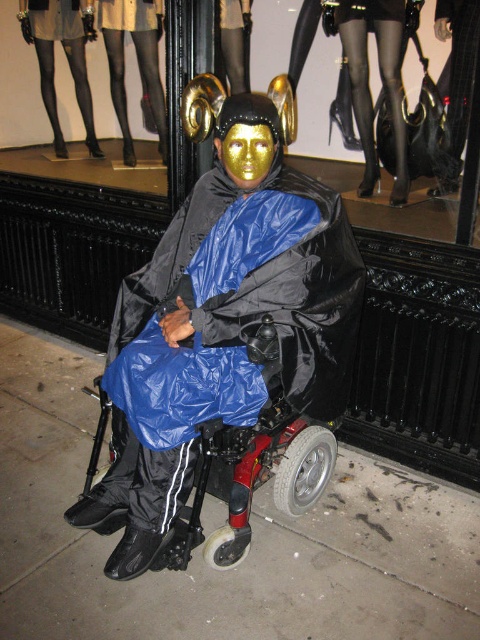
Question: Among these objects, which one is nearest to the camera?

Choices:
 (A) black tights at upper center
 (B) metallic gold mask at center
 (C) brushed metal belt at upper center
 (D) shiny gold mask at center

Answer: (D)

Question: Is shiny gold mask at center positioned behind gold glitter mask at center?

Choices:
 (A) no
 (B) yes

Answer: (A)

Question: Does black tights at center appear on the right side of gold glitter mask at center?

Choices:
 (A) no
 (B) yes

Answer: (B)

Question: Can you confirm if concrete sidewalk at center is positioned below metallic red wheelchair at center?

Choices:
 (A) no
 (B) yes

Answer: (B)

Question: Which point appears closest to the camera in this image?

Choices:
 (A) (88, 99)
 (B) (241, 19)

Answer: (B)

Question: Based on their relative distances, which object is nearer to the brushed metal belt at upper center?

Choices:
 (A) concrete sidewalk at center
 (B) metallic gold mask at center

Answer: (B)